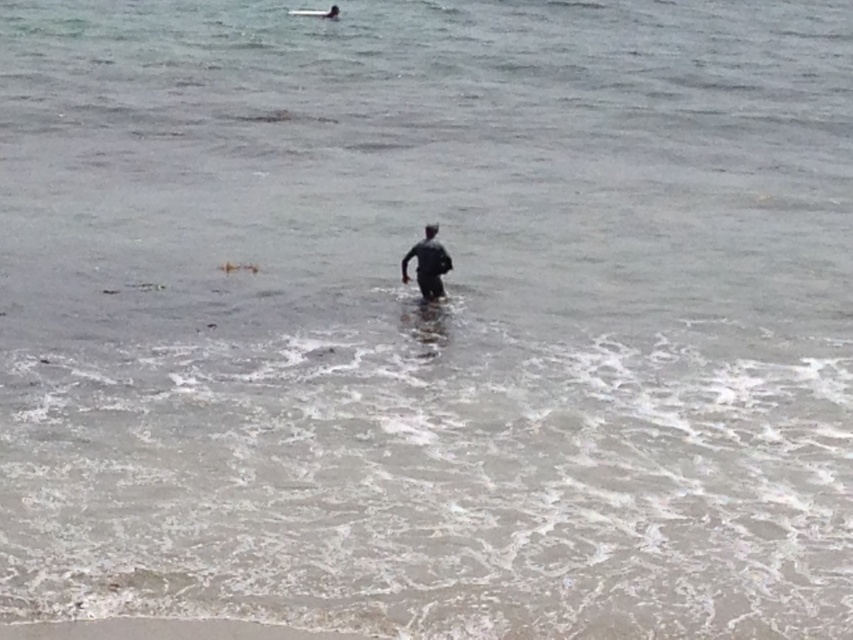
Question: Based on their relative distances, which object is farther from the white foam surfboard at center?

Choices:
 (A) dark gray wetsuit at center
 (B) smooth sand at lower center

Answer: (B)

Question: Which point is farther to the camera?

Choices:
 (A) (334, 13)
 (B) (187, 620)
 (C) (405, 272)

Answer: (A)

Question: Among these objects, which one is farthest from the camera?

Choices:
 (A) white foam surfboard at center
 (B) smooth sand at lower center
 (C) dark gray wetsuit at center

Answer: (A)

Question: Is smooth sand at lower center below white foam surfboard at center?

Choices:
 (A) yes
 (B) no

Answer: (A)

Question: Is the position of dark gray wetsuit at center more distant than that of white foam surfboard at center?

Choices:
 (A) yes
 (B) no

Answer: (B)

Question: Can you confirm if dark gray wetsuit at center is bigger than white foam surfboard at center?

Choices:
 (A) yes
 (B) no

Answer: (B)